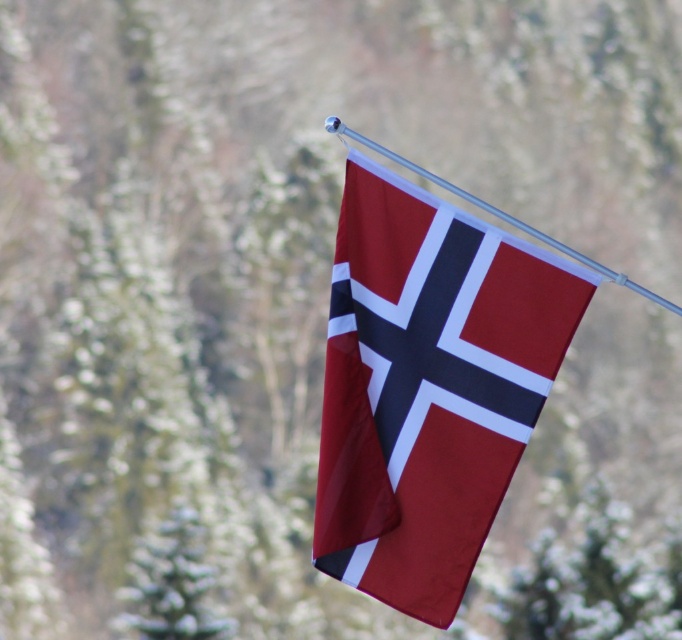
You are a photographer standing at a certain distance from the matte fabric flag at center. You want to capture a clear photo of the flag without any background blur. According to the scene description, what is the minimum distance you should be from the flag to ensure the background is not blurry?

The matte fabric flag at center and camera are 15.18 meters apart from each other. To ensure the background is not blurry, you should be at least 15.18 meters away from the matte fabric flag at center.

You are standing in front of the Norwegian flag scene. You see the matte fabric flag at center and the metallic silver flag pole at upper center. Which object is positioned more to the left?

The matte fabric flag at center is positioned more to the left than the metallic silver flag pole at upper center.